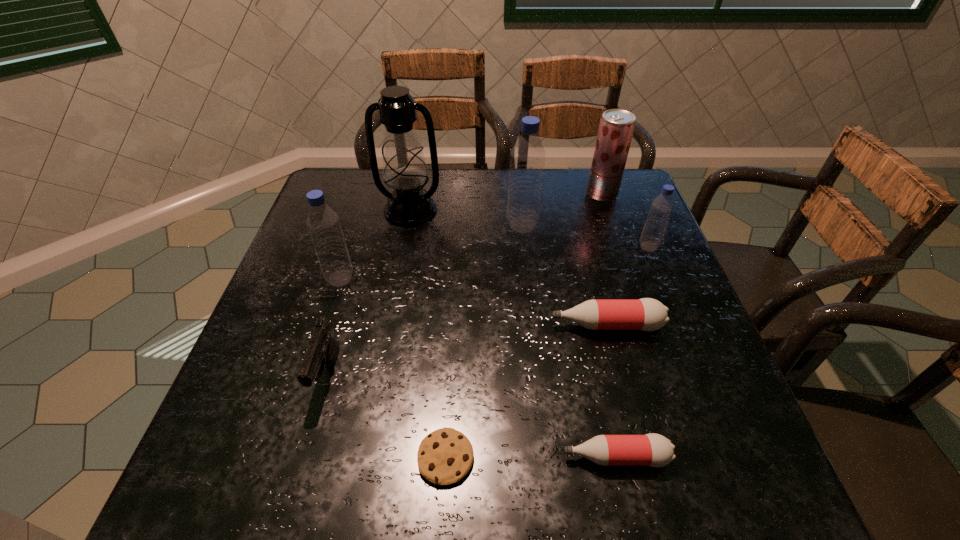
Identify the location of black pistol. (323, 350).

The height and width of the screenshot is (540, 960). I want to click on the sixth farthest object, so click(646, 314).

The image size is (960, 540). Identify the location of the bigger pink bottle. (646, 314).

Locate an element on the screen. The width and height of the screenshot is (960, 540). the nearer pink bottle is located at coordinates (655, 450).

Locate an element on the screen. The width and height of the screenshot is (960, 540). the shortest bottle is located at coordinates (655, 450).

Find the location of a particular element. Image resolution: width=960 pixels, height=540 pixels. brown cookie is located at coordinates (445, 456).

I want to click on cookie, so click(445, 456).

Image resolution: width=960 pixels, height=540 pixels. Find the location of `vacant area situated on the front of the black oil lamp`. vacant area situated on the front of the black oil lamp is located at coordinates (391, 318).

In order to click on free region located 0.190m on the back of the biggest blue bottle in this screenshot , I will do `click(517, 177)`.

Image resolution: width=960 pixels, height=540 pixels. I want to click on free region located 0.150m on the left of the fruit juice, so click(x=536, y=194).